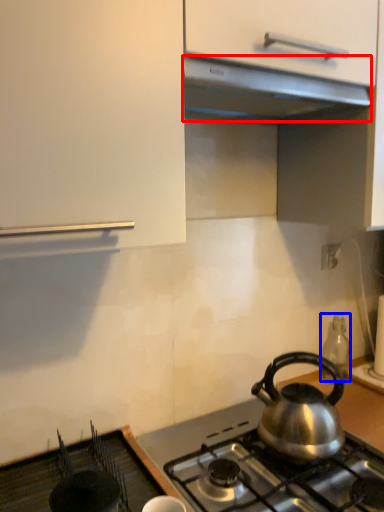
Question: Which object is further to the camera taking this photo, exhaust hood (highlighted by a red box) or appliance (highlighted by a blue box)?

Choices:
 (A) exhaust hood
 (B) appliance

Answer: (B)